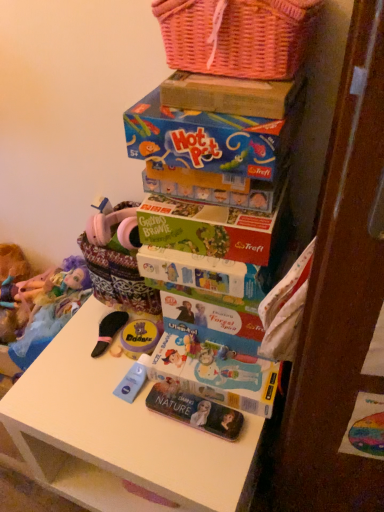
Locate an element on the screen. free space above cardboard box at upper center (from a real-world perspective) is located at coordinates (225, 77).